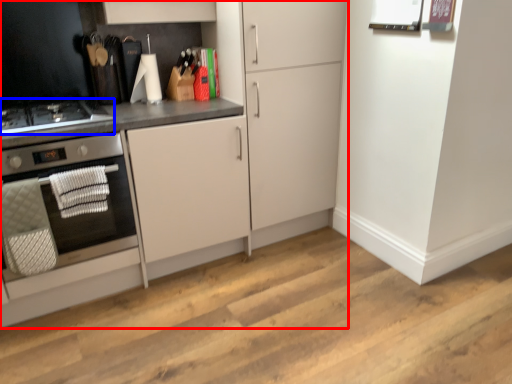
Question: Which of the following is the closest to the observer, cabinetry (highlighted by a red box) or gas stove (highlighted by a blue box)?

Choices:
 (A) cabinetry
 (B) gas stove

Answer: (A)